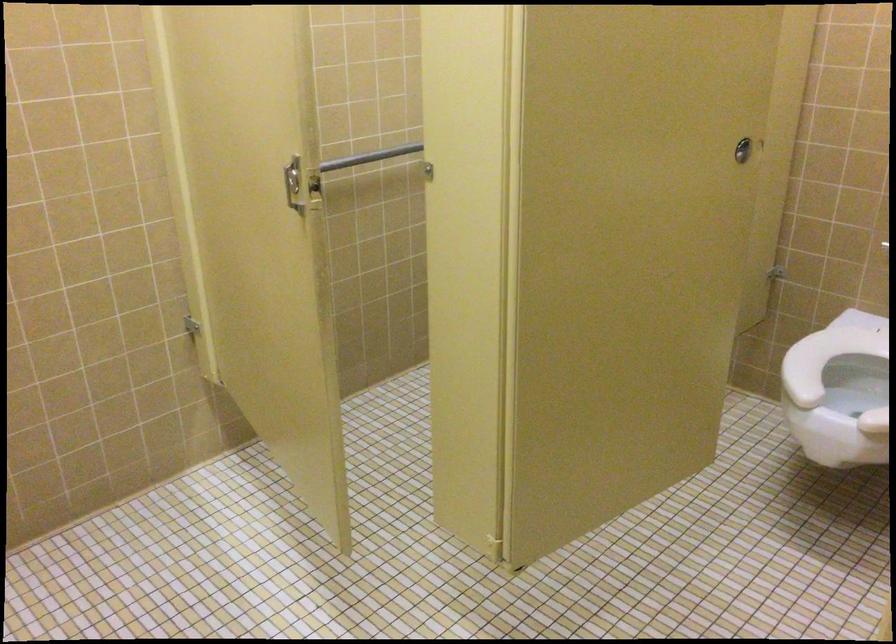
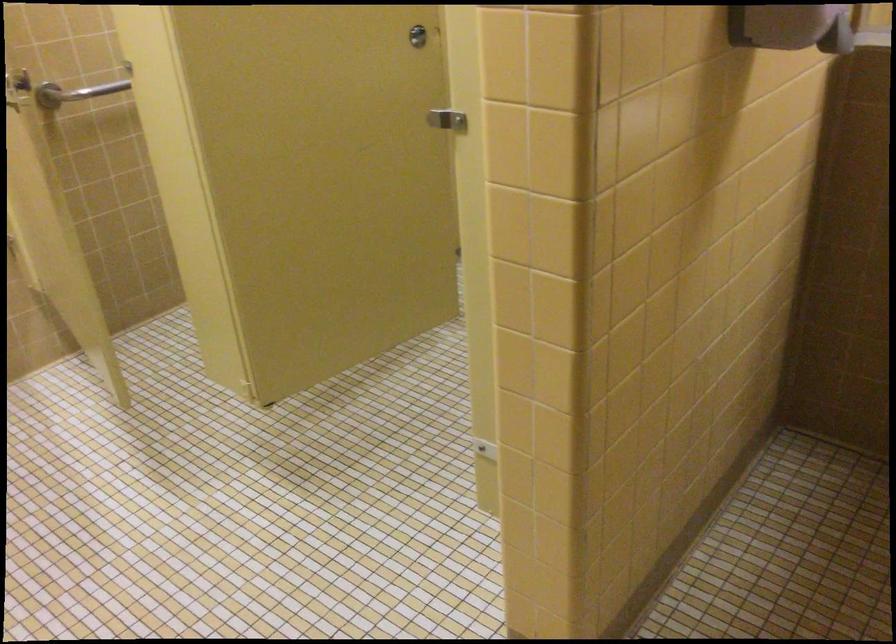
Question: I am providing you with two images of the same scene from different viewpoints. After the viewpoint changes to image2, which objects are now occluded?

Choices:
 (A) brown chair surface
 (B) stall door latch
 (C) metal grab bar
 (D) white toilet seat

Answer: (D)